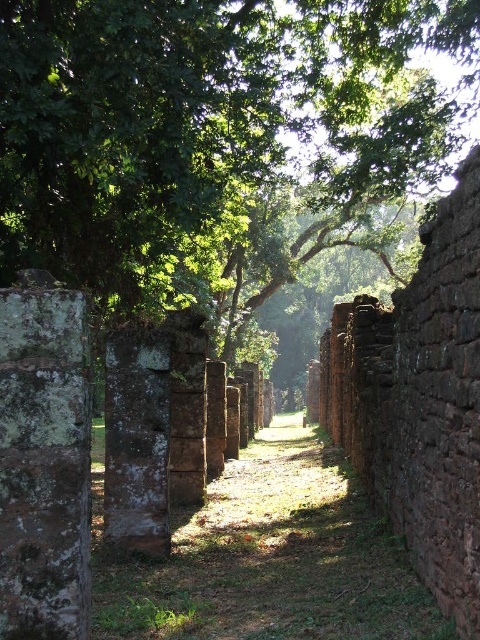
You are a hiker walking along the ancient pathway. You notice a green leafy tree at center and a rusty stone pillar at center. Which object is directly above the other?

The green leafy tree at center is positioned over the rusty stone pillar at center, so the tree is directly above the pillar.

You are a hiker walking along the ancient pathway and notice a green leafy tree at center and a rusty stone pillar at center. Which object is located to the left when facing the pathway ahead?

The green leafy tree at center is positioned on the left side of the rusty stone pillar at center, so when facing the pathway ahead, the green leafy tree at center is to the left of the rusty stone pillar at center.

You are standing on the ancient pathway and want to determine which object is taller between the green leafy tree at center and the rusty stone pillar at center. Based on the scene, which one is taller?

The green leafy tree at center has a lesser height compared to the rusty stone pillar at center, so the rusty stone pillar at center is taller.